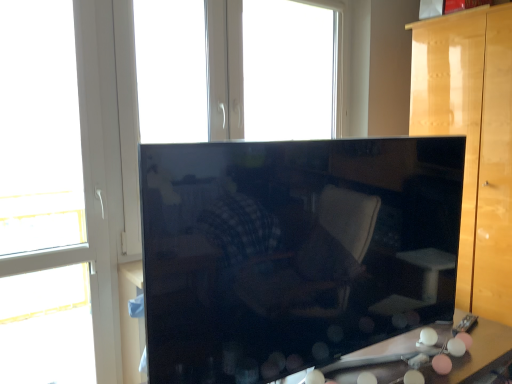
Where is `white plastic window at upper center, the 1th window from the back`? white plastic window at upper center, the 1th window from the back is located at coordinates (289, 70).

At what (x,y) coordinates should I click in order to perform the action: click on glossy wood cabinet at right. Please return your answer as a coordinate pair (x, y). Looking at the image, I should click on (473, 140).

From a real-world perspective, relative to glossy wood cabinet at center, is white plastic window at left, which is the 2th window in back-to-front order, vertically above or below?

In terms of real-world spatial position, white plastic window at left, which is the 2th window in back-to-front order, is above glossy wood cabinet at center.

Relative to glossy wood cabinet at center, is white plastic window at left, the 1th window from the left, in front or behind?

Clearly, white plastic window at left, the 1th window from the left, is behind glossy wood cabinet at center.

Choose the correct answer: Is white plastic window at left, the 1th window from the left, inside glossy wood cabinet at center or outside it?

white plastic window at left, the 1th window from the left, lies outside glossy wood cabinet at center.

Which object is positioned more to the right, white plastic window at left, which is the 2th window in back-to-front order, or glossy wood cabinet at center?

glossy wood cabinet at center.

Is matte plastic table at lower right positioned with its back to glossy wood cabinet at right?

matte plastic table at lower right does not have its back to glossy wood cabinet at right.

Considering the points (373, 354) and (434, 75), which point is behind, point (373, 354) or point (434, 75)?

The point (434, 75) is behind.

How much distance is there between matte plastic table at lower right and glossy wood cabinet at right?

A distance of 84.26 centimeters exists between matte plastic table at lower right and glossy wood cabinet at right.

The image size is (512, 384). What are the coordinates of `furniture behind the matte plastic table at lower right` in the screenshot? It's located at (473, 140).

Which of these two, white plastic window at upper center, the 2th window when ordered from left to right, or glossy wood cabinet at center, stands taller?

With more height is white plastic window at upper center, the 2th window when ordered from left to right.

How different are the orientations of white plastic window at upper center, placed as the first window when sorted from right to left, and glossy wood cabinet at center in degrees?

5.74 degrees.

Is white plastic window at upper center, the 1th window from the back, wider or thinner than glossy wood cabinet at center?

In the image, white plastic window at upper center, the 1th window from the back, appears to be more narrow than glossy wood cabinet at center.

Would you say glossy wood cabinet at center is outside glossy wood cabinet at right?

Yes, glossy wood cabinet at center is not within glossy wood cabinet at right.

Considering the relative positions of glossy wood cabinet at center and glossy wood cabinet at right in the image provided, is glossy wood cabinet at center to the left of glossy wood cabinet at right from the viewer's perspective?

Correct, you'll find glossy wood cabinet at center to the left of glossy wood cabinet at right.

The height and width of the screenshot is (384, 512). In order to click on furniture on the right of glossy wood cabinet at center in this screenshot , I will do `click(473, 140)`.

Is glossy wood cabinet at center aimed at glossy wood cabinet at right?

No, glossy wood cabinet at center does not turn towards glossy wood cabinet at right.

Considering the sizes of objects matte plastic table at lower right and glossy wood cabinet at center in the image provided, who is taller, matte plastic table at lower right or glossy wood cabinet at center?

glossy wood cabinet at center is taller.

Can you confirm if matte plastic table at lower right is positioned to the right of glossy wood cabinet at center?

Yes, matte plastic table at lower right is to the right of glossy wood cabinet at center.

Could you tell me if matte plastic table at lower right is facing glossy wood cabinet at center?

No, matte plastic table at lower right is not oriented towards glossy wood cabinet at center.

Which is behind, point (372, 353) or point (186, 193)?

The point (372, 353) is farther.

Based on the photo, is glossy wood cabinet at right bigger or smaller than matte plastic table at lower right?

In the image, glossy wood cabinet at right appears to be larger than matte plastic table at lower right.

In the scene shown: Choose the correct answer: Is glossy wood cabinet at right inside matte plastic table at lower right or outside it?

glossy wood cabinet at right is outside matte plastic table at lower right.

From a real-world perspective, who is located lower, glossy wood cabinet at right or matte plastic table at lower right?

matte plastic table at lower right.

From the picture: How many degrees apart are the facing directions of matte plastic table at lower right and white plastic window at left, which ranks as the second window in right-to-left order?

2.17 degrees.

Can you confirm if matte plastic table at lower right is smaller than white plastic window at left, which is the 2th window in back-to-front order?

Indeed, matte plastic table at lower right has a smaller size compared to white plastic window at left, which is the 2th window in back-to-front order.

Considering the sizes of objects matte plastic table at lower right and white plastic window at left, which ranks as the second window in right-to-left order, in the image provided, who is thinner, matte plastic table at lower right or white plastic window at left, which ranks as the second window in right-to-left order,?

matte plastic table at lower right is thinner.

Is matte plastic table at lower right oriented away from white plastic window at left, which ranks as the second window in right-to-left order?

No.

Find the location of a particular element. The width and height of the screenshot is (512, 384). window that is the 1st object located above the glossy wood cabinet at center (from the image's perspective) is located at coordinates (93, 185).

Locate an element on the screen. Image resolution: width=512 pixels, height=384 pixels. furniture behind the matte plastic table at lower right is located at coordinates (473, 140).

From the image, which object appears to be farther from matte plastic table at lower right, white plastic window at left, which is the 2th window in back-to-front order, or glossy wood cabinet at center?

The object further to matte plastic table at lower right is white plastic window at left, which is the 2th window in back-to-front order.

When comparing their distances from glossy wood cabinet at center, does glossy wood cabinet at right or white plastic window at left, the first window when ordered from front to back, seem further?

white plastic window at left, the first window when ordered from front to back, lies further to glossy wood cabinet at center than the other object.

Looking at the image, which one is located further to glossy wood cabinet at right, glossy wood cabinet at center or white plastic window at left, the first window when ordered from front to back?

white plastic window at left, the first window when ordered from front to back, is further to glossy wood cabinet at right.

When comparing their distances from white plastic window at left, which is the 2th window in back-to-front order, does glossy wood cabinet at right or matte plastic table at lower right seem further?

glossy wood cabinet at right is positioned further to the anchor white plastic window at left, which is the 2th window in back-to-front order.

Consider the image. Considering their positions, is white plastic window at left, which ranks as the second window in right-to-left order, positioned further to glossy wood cabinet at right than glossy wood cabinet at center?

white plastic window at left, which ranks as the second window in right-to-left order.

When comparing their distances from matte plastic table at lower right, does white plastic window at upper center, which is the second window in front-to-back order, or glossy wood cabinet at center seem closer?

Among the two, glossy wood cabinet at center is located nearer to matte plastic table at lower right.

Based on their spatial positions, is white plastic window at upper center, placed as the first window when sorted from right to left, or white plastic window at left, the 1th window from the left, closer to matte plastic table at lower right?

Based on the image, white plastic window at left, the 1th window from the left, appears to be nearer to matte plastic table at lower right.

Estimate the real-world distances between objects in this image. Which object is further from glossy wood cabinet at right, matte plastic table at lower right or white plastic window at upper center, placed as the first window when sorted from right to left?

Among the two, white plastic window at upper center, placed as the first window when sorted from right to left, is located further to glossy wood cabinet at right.

I want to click on cabinetry between white plastic window at upper center, placed as the first window when sorted from right to left, and matte plastic table at lower right, in the vertical direction, so click(293, 251).

You are a GUI agent. You are given a task and a screenshot of the screen. Output one action in this format:
    pyautogui.click(x=<x>, y=<y>)
    Task: Click on the table between glossy wood cabinet at center and glossy wood cabinet at right
    
    Given the screenshot: What is the action you would take?
    pyautogui.click(x=477, y=354)

Where is `cabinetry located between white plastic window at left, the 1th window from the left, and matte plastic table at lower right in the left-right direction`? cabinetry located between white plastic window at left, the 1th window from the left, and matte plastic table at lower right in the left-right direction is located at coordinates (293, 251).

At what (x,y) coordinates should I click in order to perform the action: click on table between white plastic window at left, the 1th window from the left, and glossy wood cabinet at right. Please return your answer as a coordinate pair (x, y). Looking at the image, I should click on (477, 354).